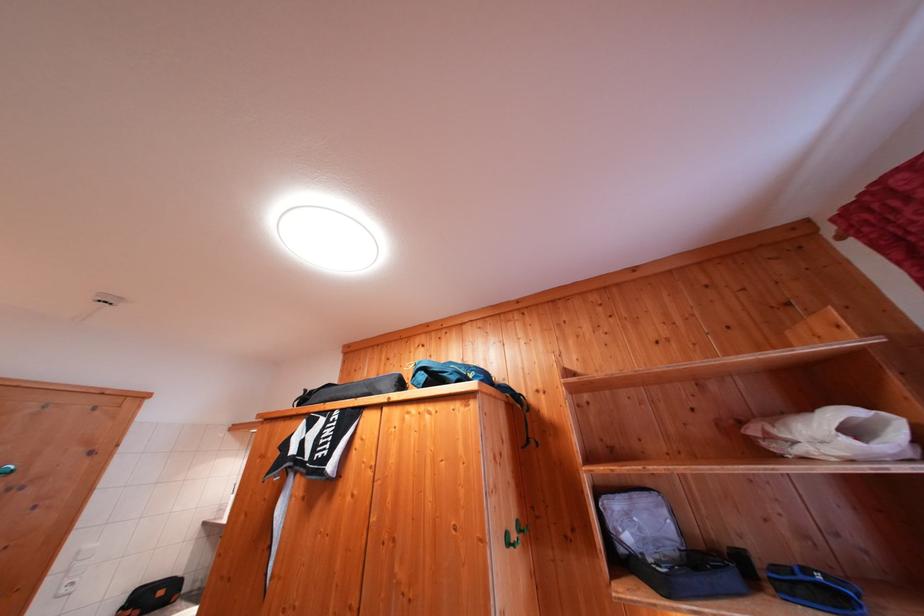
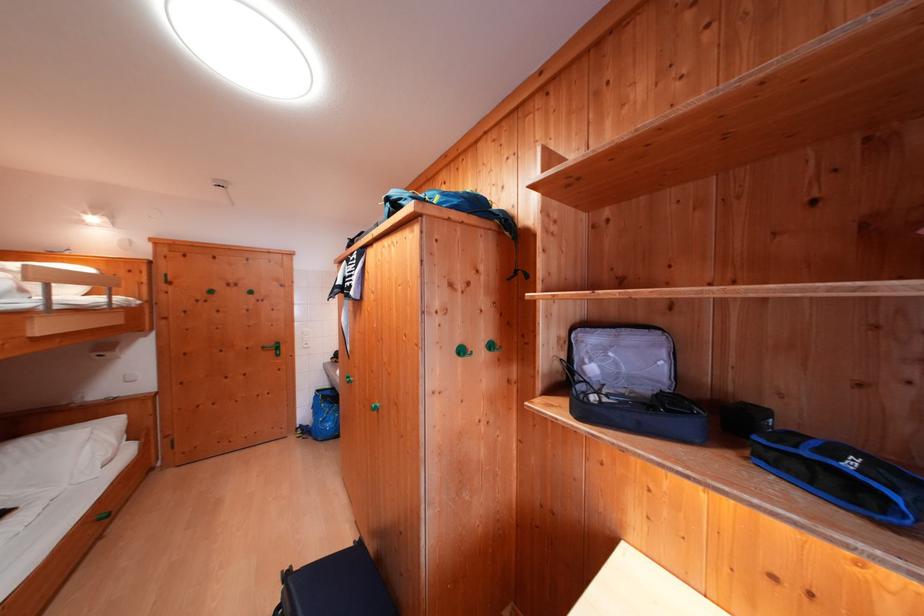
Find the pixel in the second image that matches pixel 811 582 in the first image.

(815, 456)